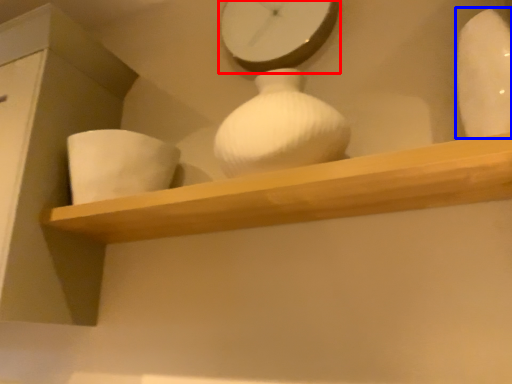
Question: Among these objects, which one is nearest to the camera, clock (highlighted by a red box) or vase (highlighted by a blue box)?

Choices:
 (A) clock
 (B) vase

Answer: (B)